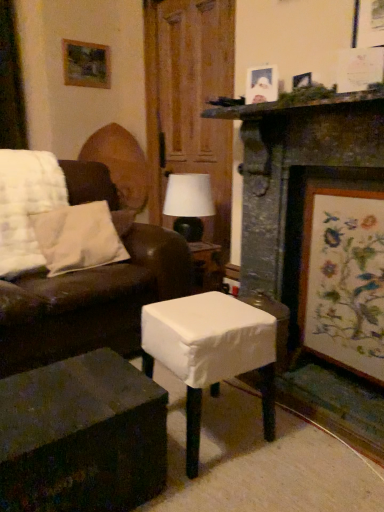
Question: Should I look upward or downward to see wooden picture frame at upper left, which is the 1th picture frame from back to front?

Choices:
 (A) down
 (B) up

Answer: (B)

Question: Is wooden framed artwork at right, acting as the third picture frame starting from the top, aimed at dark wood table at lower left, marked as the first table in a left-to-right arrangement?

Choices:
 (A) no
 (B) yes

Answer: (B)

Question: Does wooden framed artwork at right, acting as the third picture frame starting from the top, have a greater height compared to dark wood table at lower left, marked as the first table in a left-to-right arrangement?

Choices:
 (A) yes
 (B) no

Answer: (A)

Question: Considering the relative sizes of wooden framed artwork at right, acting as the third picture frame starting from the top, and dark wood table at lower left, positioned as the 2th table in right-to-left order, in the image provided, is wooden framed artwork at right, acting as the third picture frame starting from the top, smaller than dark wood table at lower left, positioned as the 2th table in right-to-left order,?

Choices:
 (A) yes
 (B) no

Answer: (A)

Question: Is wooden framed artwork at right, which ranks as the first picture frame in right-to-left order, shorter than dark wood table at lower left, positioned as the 2th table in right-to-left order?

Choices:
 (A) no
 (B) yes

Answer: (A)

Question: From the image's perspective, would you say wooden framed artwork at right, the third picture frame when ordered from left to right, is positioned over dark wood table at lower left, positioned as the 2th table in right-to-left order?

Choices:
 (A) no
 (B) yes

Answer: (B)

Question: Considering the relative positions of wooden framed artwork at right, which ranks as the first picture frame in right-to-left order, and dark wood table at lower left, marked as the first table in a left-to-right arrangement, in the image provided, is wooden framed artwork at right, which ranks as the first picture frame in right-to-left order, behind dark wood table at lower left, marked as the first table in a left-to-right arrangement,?

Choices:
 (A) no
 (B) yes

Answer: (B)

Question: Does dark wood table at lower left, marked as the first table in a left-to-right arrangement, appear on the left side of white fabric-covered stool at center, which ranks as the first table in right-to-left order?

Choices:
 (A) no
 (B) yes

Answer: (B)

Question: Can you confirm if dark wood table at lower left, marked as the first table in a left-to-right arrangement, is bigger than white fabric-covered stool at center, which ranks as the first table in right-to-left order?

Choices:
 (A) yes
 (B) no

Answer: (B)

Question: Does dark wood table at lower left, marked as the first table in a left-to-right arrangement, turn towards white fabric-covered stool at center, which ranks as the first table in right-to-left order?

Choices:
 (A) no
 (B) yes

Answer: (A)

Question: From a real-world perspective, does dark wood table at lower left, positioned as the 2th table in right-to-left order, sit lower than white fabric-covered stool at center, which ranks as the first table in right-to-left order?

Choices:
 (A) yes
 (B) no

Answer: (A)

Question: From a real-world perspective, does dark wood table at lower left, marked as the first table in a left-to-right arrangement, stand above white fabric-covered stool at center, which ranks as the first table in right-to-left order?

Choices:
 (A) yes
 (B) no

Answer: (B)

Question: Is dark wood table at lower left, positioned as the 2th table in right-to-left order, shorter than white fabric-covered stool at center, which ranks as the first table in right-to-left order?

Choices:
 (A) yes
 (B) no

Answer: (A)

Question: Can dark wood table at lower left, positioned as the 2th table in right-to-left order, be found inside matte white picture frame at upper right, which is counted as the second picture frame, starting from the right?

Choices:
 (A) yes
 (B) no

Answer: (B)